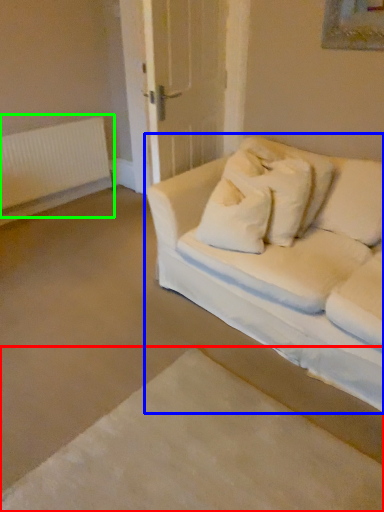
Question: Which object is the farthest from bed frame (highlighted by a red box)? Choose among these: studio couch (highlighted by a blue box) or radiator (highlighted by a green box).

Choices:
 (A) studio couch
 (B) radiator

Answer: (B)